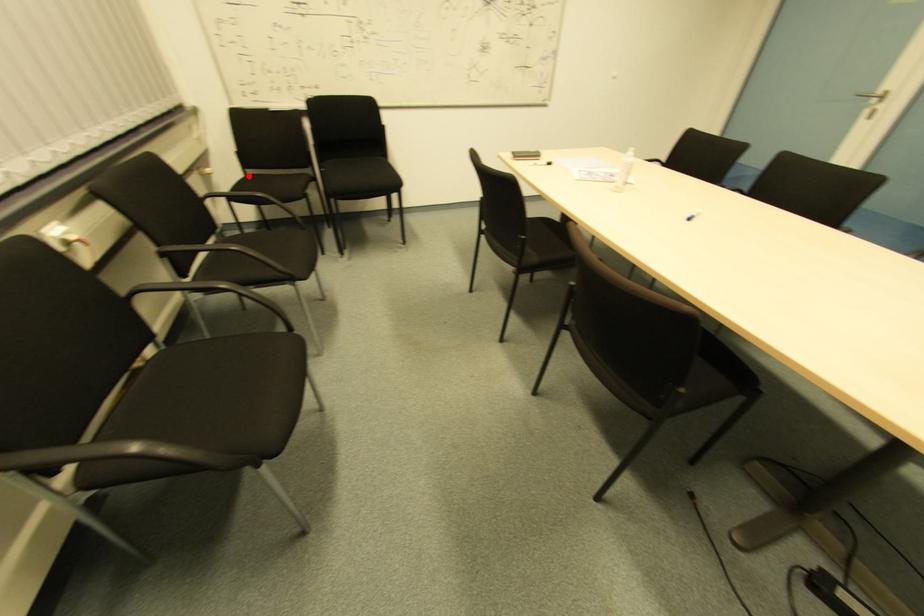
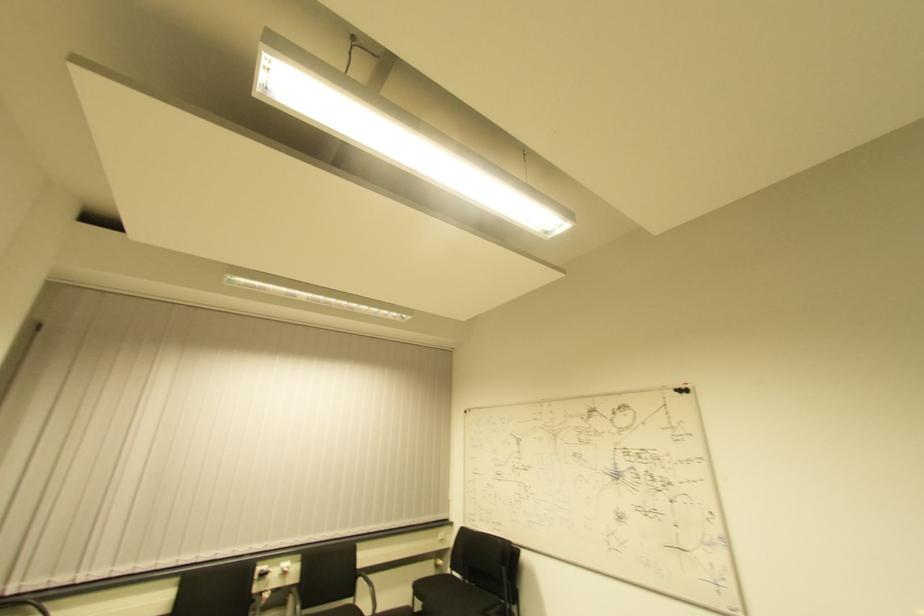
Question: I am providing you with two images of the same scene from different viewpoints. In image1, a red point is highlighted. Considering the same 3D point in image2, which of the following is correct?

Choices:
 (A) It is closer
 (B) It is farther

Answer: (A)